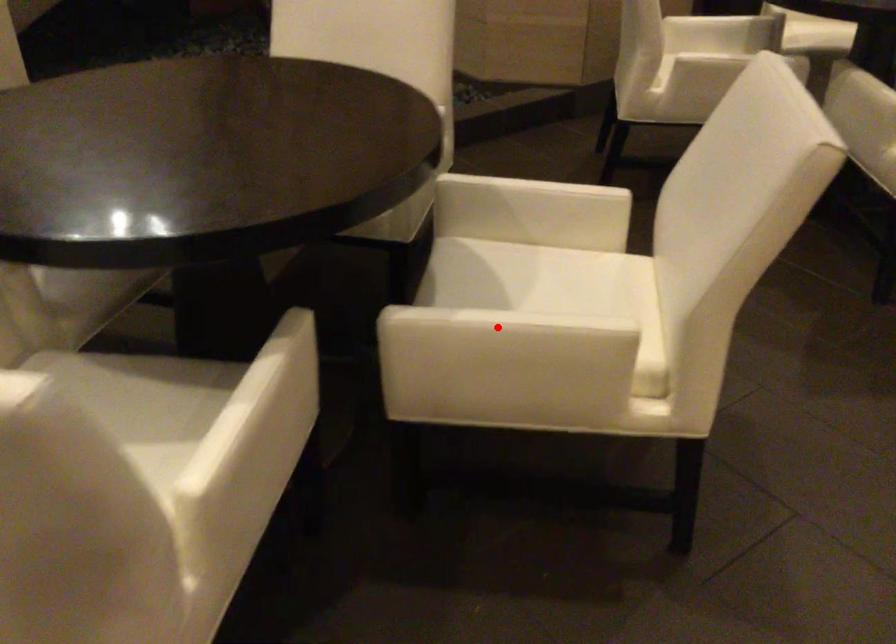
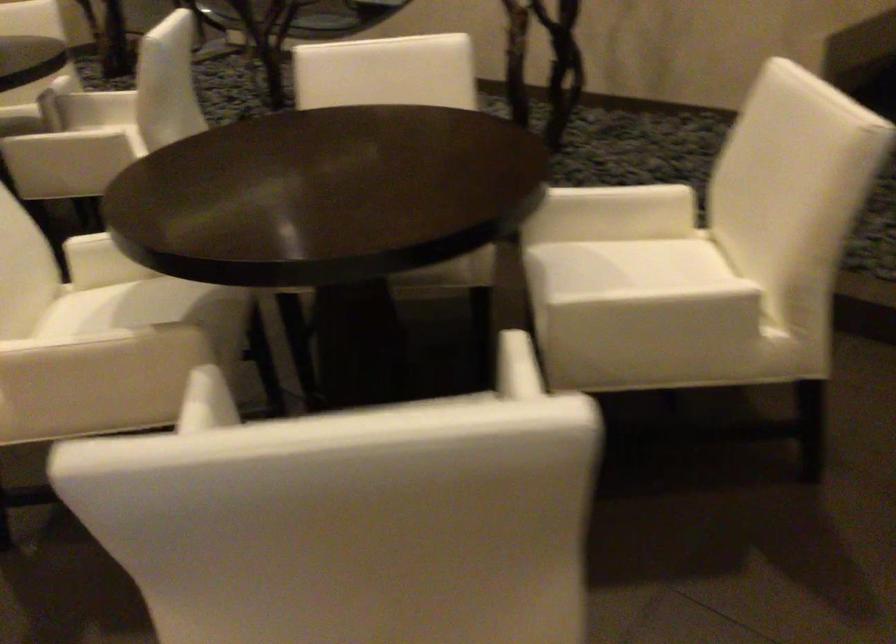
Question: I am providing you with two images of the same scene from different viewpoints. A red point is marked on the first image. At the location where the point appears in image 1, is it still visible in image 2?

Choices:
 (A) Yes
 (B) No

Answer: (B)